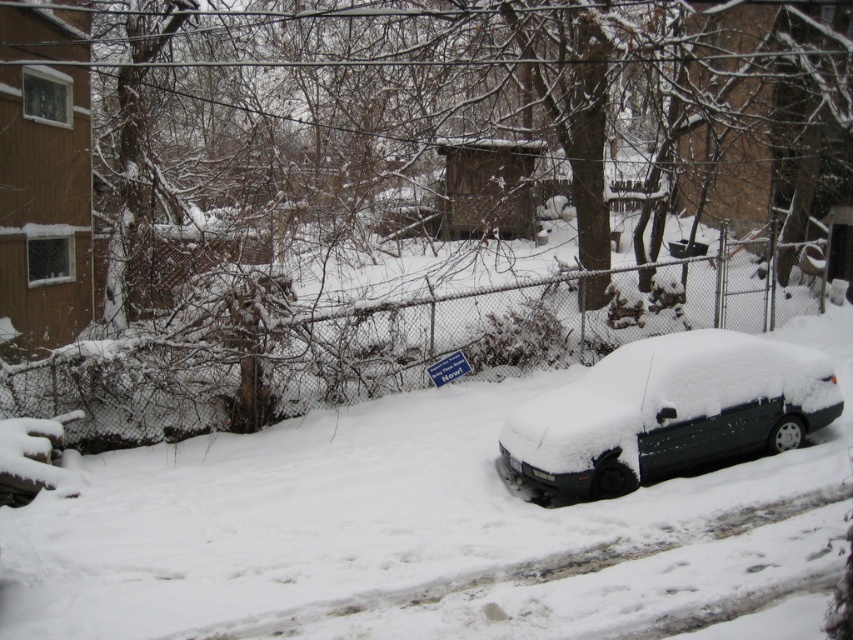
Who is positioned more to the left, chain-link fence at center or snow-covered sedan at right?

From the viewer's perspective, chain-link fence at center appears more on the left side.

Who is taller, chain-link fence at center or snow-covered sedan at right?

chain-link fence at center

What do you see at coordinates (392, 348) in the screenshot? I see `chain-link fence at center` at bounding box center [392, 348].

At what (x,y) coordinates should I click in order to perform the action: click on chain-link fence at center. Please return your answer as a coordinate pair (x, y). Looking at the image, I should click on (392, 348).